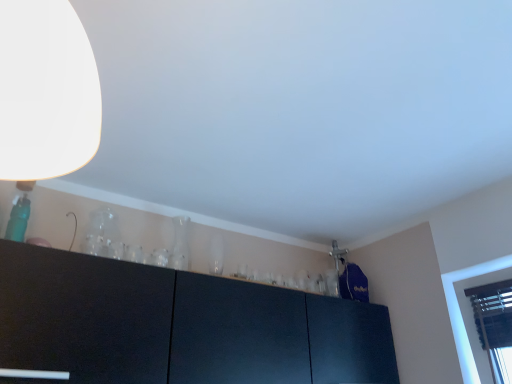
You are a GUI agent. You are given a task and a screenshot of the screen. Output one action in this format:
    pyautogui.click(x=<x>, y=<y>)
    Task: Click on the transparent glass vase at upper center, positioned as the 1th glass vase in left-to-right order
    
    Given the screenshot: What is the action you would take?
    pyautogui.click(x=103, y=235)

What is the approximate height of white matte lampshade at upper left?

white matte lampshade at upper left is 17.19 inches tall.

Locate an element on the screen. This screenshot has width=512, height=384. transparent glass vase at upper center, acting as the second glass vase starting from the right is located at coordinates (103, 235).

Are white matte lampshade at upper left and transparent glass vase at center, the second glass vase from the left, far apart?

Yes, white matte lampshade at upper left and transparent glass vase at center, the second glass vase from the left, are located far from each other.

You are a GUI agent. You are given a task and a screenshot of the screen. Output one action in this format:
    pyautogui.click(x=<x>, y=<y>)
    Task: Click on the lamp beneath the transparent glass vase at center, marked as the 1th glass vase in a right-to-left arrangement (from a real-world perspective)
    
    Given the screenshot: What is the action you would take?
    click(44, 98)

Visually, is white matte lampshade at upper left positioned to the left or to the right of transparent glass vase at center, the second glass vase from the left?

Based on their positions, white matte lampshade at upper left is located to the right of transparent glass vase at center, the second glass vase from the left.

Is transparent glass vase at center, marked as the 1th glass vase in a right-to-left arrangement, at the back of white matte lampshade at upper left?

No, transparent glass vase at center, marked as the 1th glass vase in a right-to-left arrangement, is not at the back of white matte lampshade at upper left.

Can we say transparent glass vase at upper center, positioned as the 1th glass vase in left-to-right order, lies outside transparent glass vase at center, positioned as the first glass vase in back-to-front order?

transparent glass vase at upper center, positioned as the 1th glass vase in left-to-right order, lies outside transparent glass vase at center, positioned as the first glass vase in back-to-front order,'s area.

What's the angular difference between transparent glass vase at upper center, acting as the second glass vase starting from the right, and transparent glass vase at center, positioned as the first glass vase in back-to-front order,'s facing directions?

There is a 0.000696-degree angle between the facing directions of transparent glass vase at upper center, acting as the second glass vase starting from the right, and transparent glass vase at center, positioned as the first glass vase in back-to-front order.

Is transparent glass vase at upper center, the 2th glass vase in the back-to-front sequence, far from transparent glass vase at center, the second glass vase from the left?

transparent glass vase at upper center, the 2th glass vase in the back-to-front sequence, is actually quite close to transparent glass vase at center, the second glass vase from the left.

Which point is more distant from viewer, (92, 225) or (184, 219)?

The point (184, 219) is more distant.

Looking at their sizes, would you say transparent glass vase at upper center, which is the 1th glass vase in front-to-back order, is wider or thinner than white matte lampshade at upper left?

Clearly, transparent glass vase at upper center, which is the 1th glass vase in front-to-back order, has less width compared to white matte lampshade at upper left.

Is transparent glass vase at upper center, the 2th glass vase in the back-to-front sequence, in front of or behind white matte lampshade at upper left in the image?

In the image, transparent glass vase at upper center, the 2th glass vase in the back-to-front sequence, appears behind white matte lampshade at upper left.

From the picture: Between transparent glass vase at upper center, positioned as the 1th glass vase in left-to-right order, and white matte lampshade at upper left, which one has smaller size?

Smaller between the two is transparent glass vase at upper center, positioned as the 1th glass vase in left-to-right order.

From the image's perspective, is transparent glass vase at upper center, positioned as the 1th glass vase in left-to-right order, under white matte lampshade at upper left?

Indeed, from the image's perspective, transparent glass vase at upper center, positioned as the 1th glass vase in left-to-right order, is shown beneath white matte lampshade at upper left.

Would you consider white matte lampshade at upper left to be distant from transparent glass vase at upper center, the 2th glass vase in the back-to-front sequence?

That's right, there is a large distance between white matte lampshade at upper left and transparent glass vase at upper center, the 2th glass vase in the back-to-front sequence.

Considering the sizes of objects white matte lampshade at upper left and transparent glass vase at upper center, the 2th glass vase in the back-to-front sequence, in the image provided, who is bigger, white matte lampshade at upper left or transparent glass vase at upper center, the 2th glass vase in the back-to-front sequence,?

Bigger between the two is white matte lampshade at upper left.

Is white matte lampshade at upper left facing away from transparent glass vase at upper center, the 2th glass vase in the back-to-front sequence?

No, white matte lampshade at upper left's orientation is not away from transparent glass vase at upper center, the 2th glass vase in the back-to-front sequence.

Is the depth of white matte lampshade at upper left less than that of transparent glass vase at upper center, acting as the second glass vase starting from the right?

Yes.

Considering the points (181, 248) and (45, 122), which point is behind, point (181, 248) or point (45, 122)?

The point (181, 248) is behind.

From the image's perspective, relative to white matte lampshade at upper left, is transparent glass vase at center, the 2th glass vase viewed from the front, above or below?

From the image's perspective, transparent glass vase at center, the 2th glass vase viewed from the front, appears below white matte lampshade at upper left.

Considering the relative sizes of transparent glass vase at center, positioned as the first glass vase in back-to-front order, and white matte lampshade at upper left in the image provided, is transparent glass vase at center, positioned as the first glass vase in back-to-front order, smaller than white matte lampshade at upper left?

Yes.

How much distance is there between transparent glass vase at center, marked as the 1th glass vase in a right-to-left arrangement, and white matte lampshade at upper left?

4.52 feet.

Is transparent glass vase at center, the 2th glass vase viewed from the front, with transparent glass vase at upper center, which is the 1th glass vase in front-to-back order?

transparent glass vase at center, the 2th glass vase viewed from the front, is not next to transparent glass vase at upper center, which is the 1th glass vase in front-to-back order, and they're not touching.

Does point (176, 255) come farther from viewer compared to point (117, 223)?

Yes, it is behind point (117, 223).

Which object is closer to the camera taking this photo, transparent glass vase at center, the second glass vase from the left, or transparent glass vase at upper center, which is the 1th glass vase in front-to-back order?

Positioned in front is transparent glass vase at upper center, which is the 1th glass vase in front-to-back order.

Does transparent glass vase at center, the second glass vase from the left, turn towards transparent glass vase at upper center, acting as the second glass vase starting from the right?

No.

You are a GUI agent. You are given a task and a screenshot of the screen. Output one action in this format:
    pyautogui.click(x=<x>, y=<y>)
    Task: Click on the lamp in front of the transparent glass vase at center, the 2th glass vase viewed from the front
    This screenshot has width=512, height=384.
    Given the screenshot: What is the action you would take?
    pyautogui.click(x=44, y=98)

At what (x,y) coordinates should I click in order to perform the action: click on glass vase above the transparent glass vase at center, the 2th glass vase viewed from the front (from the image's perspective). Please return your answer as a coordinate pair (x, y). This screenshot has height=384, width=512. Looking at the image, I should click on (103, 235).

Looking at the image, which one is located closer to transparent glass vase at center, positioned as the first glass vase in back-to-front order, transparent glass vase at upper center, positioned as the 1th glass vase in left-to-right order, or white matte lampshade at upper left?

transparent glass vase at upper center, positioned as the 1th glass vase in left-to-right order.

Looking at the image, which one is located further to transparent glass vase at upper center, which is the 1th glass vase in front-to-back order, white matte lampshade at upper left or transparent glass vase at center, the 2th glass vase viewed from the front?

white matte lampshade at upper left is positioned further to the anchor transparent glass vase at upper center, which is the 1th glass vase in front-to-back order.

Considering their positions, is white matte lampshade at upper left positioned further to transparent glass vase at center, marked as the 1th glass vase in a right-to-left arrangement, than transparent glass vase at upper center, the 2th glass vase in the back-to-front sequence?

white matte lampshade at upper left lies further to transparent glass vase at center, marked as the 1th glass vase in a right-to-left arrangement, than the other object.

Looking at the image, which one is located closer to transparent glass vase at upper center, which is the 1th glass vase in front-to-back order, transparent glass vase at center, marked as the 1th glass vase in a right-to-left arrangement, or white matte lampshade at upper left?

transparent glass vase at center, marked as the 1th glass vase in a right-to-left arrangement, is closer to transparent glass vase at upper center, which is the 1th glass vase in front-to-back order.

When comparing their distances from white matte lampshade at upper left, does transparent glass vase at center, positioned as the first glass vase in back-to-front order, or transparent glass vase at upper center, which is the 1th glass vase in front-to-back order, seem closer?

transparent glass vase at upper center, which is the 1th glass vase in front-to-back order, is positioned closer to the anchor white matte lampshade at upper left.

Considering their positions, is transparent glass vase at upper center, positioned as the 1th glass vase in left-to-right order, positioned further to white matte lampshade at upper left than transparent glass vase at center, the second glass vase from the left?

Based on the image, transparent glass vase at center, the second glass vase from the left, appears to be further to white matte lampshade at upper left.

Locate an element on the screen. The height and width of the screenshot is (384, 512). glass vase between white matte lampshade at upper left and transparent glass vase at center, the 2th glass vase viewed from the front, in the front-back direction is located at coordinates (103, 235).